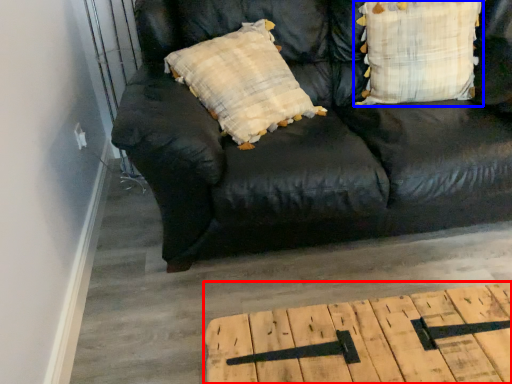
Question: Among these objects, which one is nearest to the camera, table (highlighted by a red box) or pillow (highlighted by a blue box)?

Choices:
 (A) table
 (B) pillow

Answer: (A)